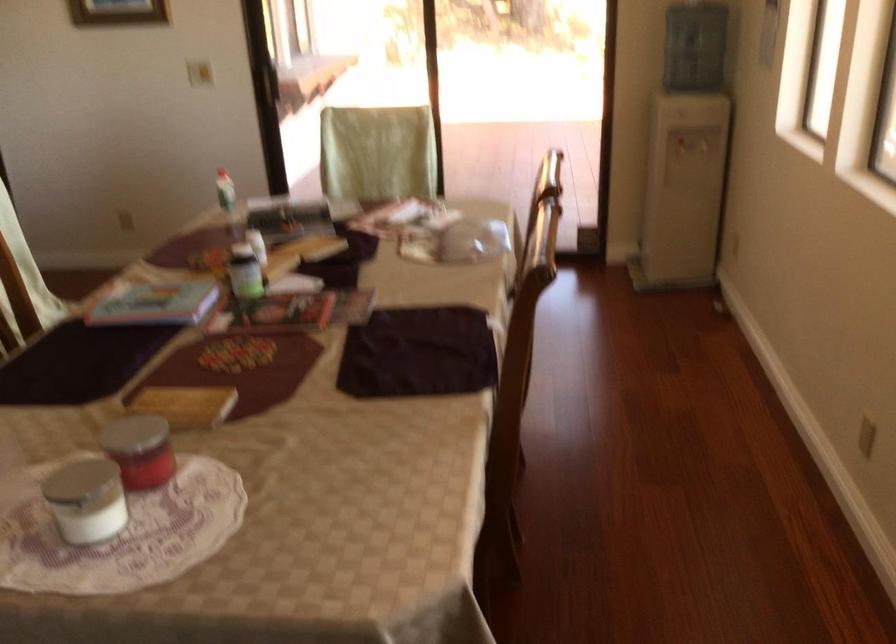
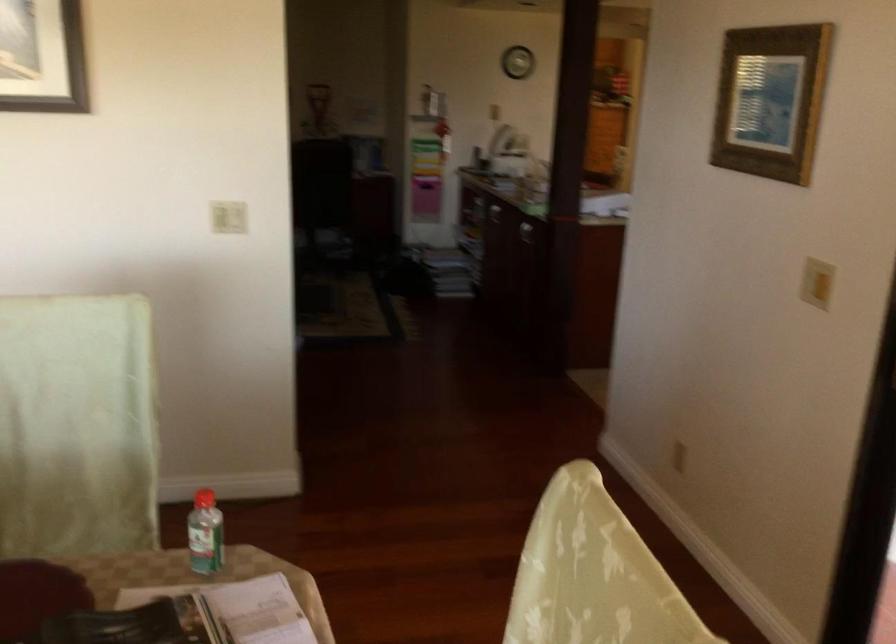
Locate, in the second image, the point that corresponds to (254,205) in the first image.

(238, 609)